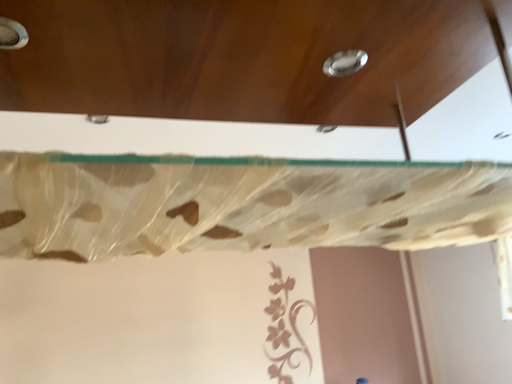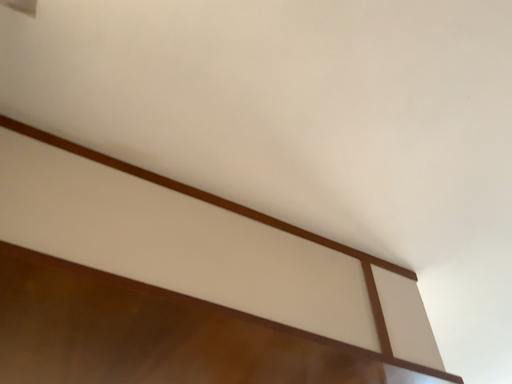
Question: Which way did the camera rotate in the video?

Choices:
 (A) rotated upward
 (B) rotated downward

Answer: (A)